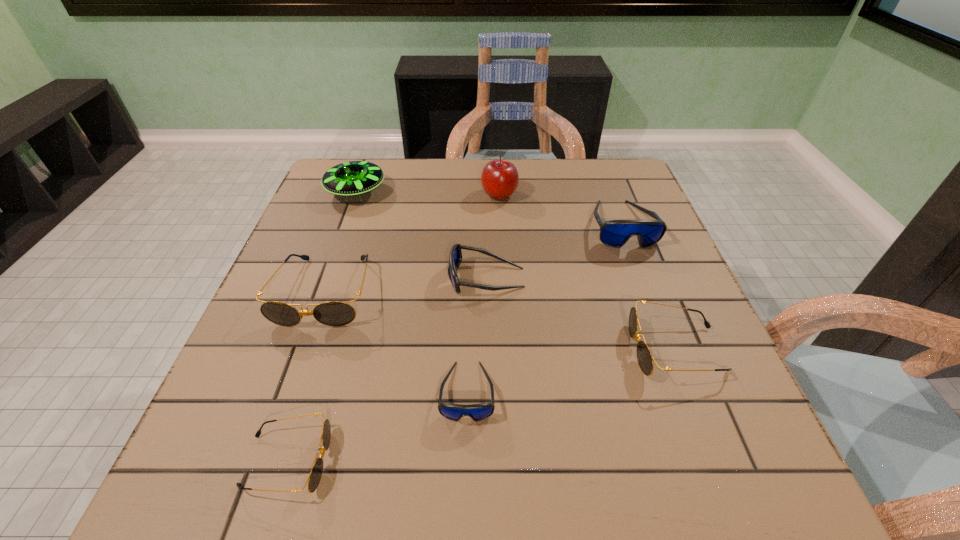
You are a GUI agent. You are given a task and a screenshot of the screen. Output one action in this format:
    pyautogui.click(x=<x>, y=<y>)
    Task: Click on the unoccupied area between the green saucer and the biggest blue sunglasses
    The width and height of the screenshot is (960, 540).
    Given the screenshot: What is the action you would take?
    pyautogui.click(x=489, y=208)

You are a GUI agent. You are given a task and a screenshot of the screen. Output one action in this format:
    pyautogui.click(x=<x>, y=<y>)
    Task: Click on the free spot between the nearest blue sunglasses and the farthest sunglasses
    Image resolution: width=960 pixels, height=540 pixels.
    Given the screenshot: What is the action you would take?
    pyautogui.click(x=544, y=308)

Locate an element on the screen. The width and height of the screenshot is (960, 540). free space between the second biggest blue sunglasses and the nearest blue sunglasses is located at coordinates (477, 335).

Where is `free space between the smallest blue sunglasses and the shortest object`? This screenshot has width=960, height=540. free space between the smallest blue sunglasses and the shortest object is located at coordinates (377, 426).

Locate an element on the screen. Image resolution: width=960 pixels, height=540 pixels. vacant area that lies between the smallest blue sunglasses and the saucer is located at coordinates (412, 292).

Image resolution: width=960 pixels, height=540 pixels. Identify the location of empty location between the tallest object and the biggest black sunglasses. (412, 243).

Locate an element on the screen. vacant area that lies between the apple and the biggest black sunglasses is located at coordinates (412, 243).

The width and height of the screenshot is (960, 540). Identify the location of the sixth closest object relative to the second biggest black sunglasses. (314, 478).

Where is `object identified as the fourth closest to the shortest object`? The height and width of the screenshot is (540, 960). object identified as the fourth closest to the shortest object is located at coordinates (644, 356).

Where is `sunglasses that is the third closest to the pink apple`? This screenshot has width=960, height=540. sunglasses that is the third closest to the pink apple is located at coordinates (333, 313).